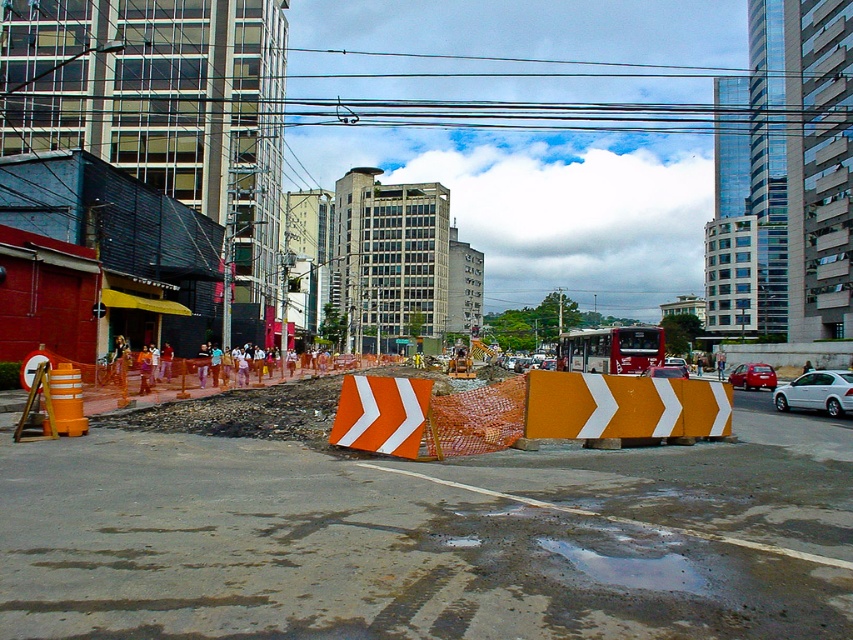
Can you confirm if yellow matte barricade at center is positioned below metallic red sedan at center right?

No.

Which is behind, point (651, 392) or point (732, 374)?

The point (732, 374) is more distant.

Find the location of a particular element. Image resolution: width=853 pixels, height=640 pixels. yellow matte barricade at center is located at coordinates (624, 406).

Is point (669, 387) closer to viewer compared to point (845, 392)?

Yes, point (669, 387) is closer to viewer.

Which is behind, point (630, 397) or point (804, 376)?

The point (804, 376) is behind.

Between point (619, 435) and point (839, 413), which one is positioned behind?

Point (839, 413)

The width and height of the screenshot is (853, 640). Find the location of `yellow matte barricade at center`. yellow matte barricade at center is located at coordinates (624, 406).

Between orange plastic barricades at center and white matte sedan at center-right, which one is positioned lower?

white matte sedan at center-right

Is point (717, 579) farther from camera compared to point (773, 404)?

No, it is in front of (773, 404).

At what (x,y) coordinates should I click in order to perform the action: click on orange plastic barricades at center. Please return your answer as a coordinate pair (x, y). Image resolution: width=853 pixels, height=640 pixels. Looking at the image, I should click on (418, 541).